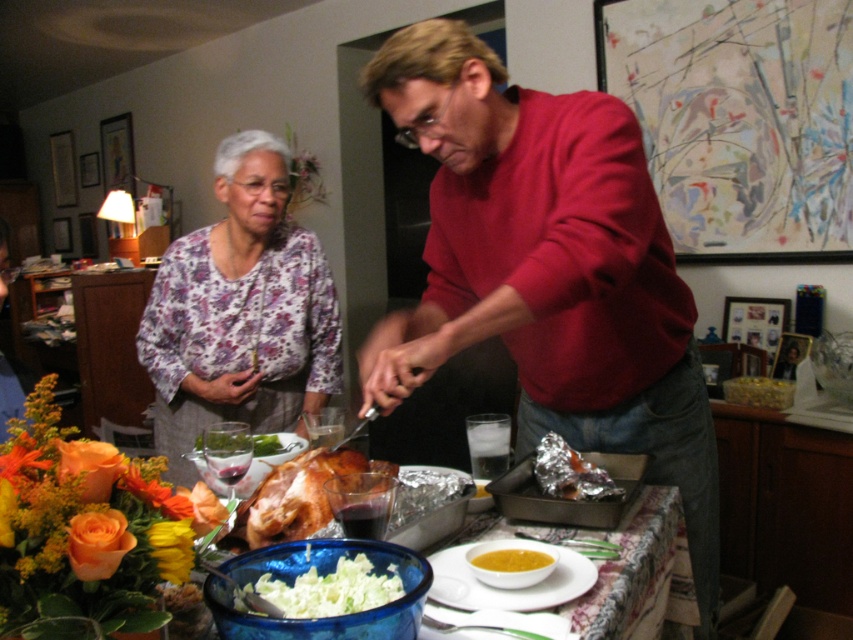
Is floral-patterned blouse at upper left smaller than shiny silver turkey at center?

No, floral-patterned blouse at upper left is not smaller than shiny silver turkey at center.

Find the location of a particular element. floral-patterned blouse at upper left is located at coordinates (241, 310).

Between point (173, 388) and point (126, 508), which one is positioned in front?

Positioned in front is point (126, 508).

Where is `floral-patterned blouse at upper left`? The height and width of the screenshot is (640, 853). floral-patterned blouse at upper left is located at coordinates (241, 310).

Measure the distance between point (61,497) and camera.

Point (61,497) is 66.92 centimeters from camera.

Does shiny silver turkey at center have a larger size compared to golden brown roasted turkey at center?

Correct, shiny silver turkey at center is larger in size than golden brown roasted turkey at center.

Find the location of a particular element. The image size is (853, 640). shiny silver turkey at center is located at coordinates (630, 566).

The height and width of the screenshot is (640, 853). What are the coordinates of `shiny silver turkey at center` in the screenshot? It's located at 630,566.

Is the position of red matte sweater at center more distant than that of shiny silver turkey at center?

Yes.

Is point (596, 218) farther from viewer compared to point (430, 490)?

No, (596, 218) is in front of (430, 490).

The width and height of the screenshot is (853, 640). I want to click on red matte sweater at center, so pyautogui.click(x=547, y=269).